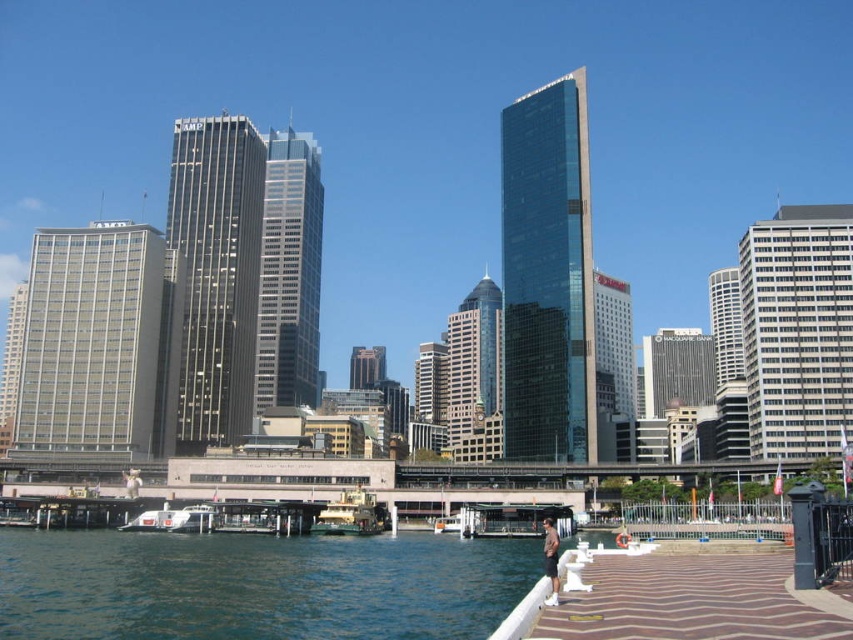
Describe the element at coordinates (172, 518) in the screenshot. The image size is (853, 640). I see `white glossy boat at lower left` at that location.

Is point (163, 509) positioned after point (132, 477)?

No, (163, 509) is closer to viewer.

Locate an element on the screen. The width and height of the screenshot is (853, 640). white glossy boat at lower left is located at coordinates tap(172, 518).

The height and width of the screenshot is (640, 853). In order to click on white glossy boat at lower left in this screenshot , I will do click(x=172, y=518).

Does green metallic ferry at center have a greater width compared to white cotton shirt at lower left?

In fact, green metallic ferry at center might be narrower than white cotton shirt at lower left.

Is green metallic ferry at center bigger than white cotton shirt at lower left?

No.

Between point (350, 518) and point (125, 477), which one is positioned behind?

The point (125, 477) is more distant.

The width and height of the screenshot is (853, 640). Find the location of `green metallic ferry at center`. green metallic ferry at center is located at coordinates (349, 515).

Who is positioned more to the right, green metallic ferry at center or tan leather jacket at lower right?

tan leather jacket at lower right is more to the right.

Who is more distant from viewer, (341, 531) or (556, 572)?

The point (341, 531) is more distant.

Locate an element on the screen. green metallic ferry at center is located at coordinates (349, 515).